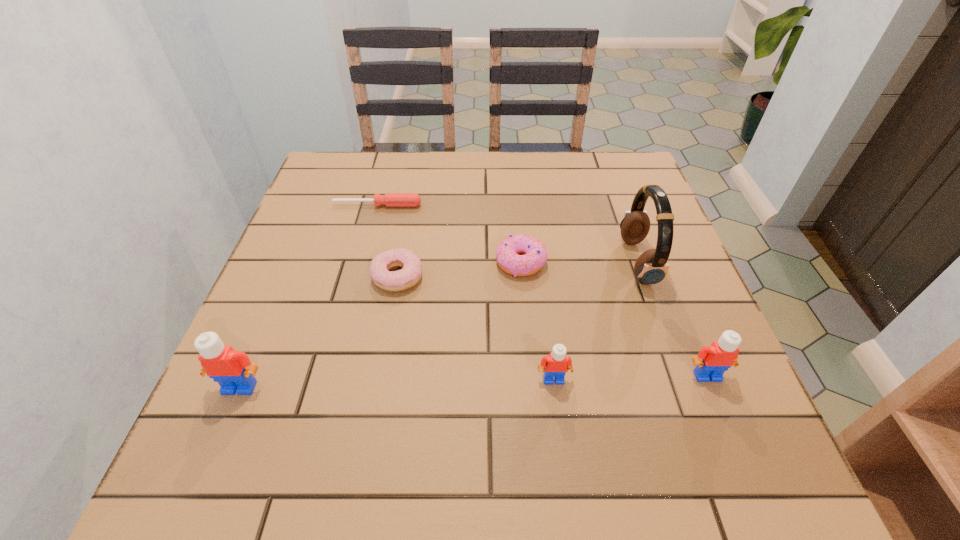
Find the location of a particular element. Image resolution: width=960 pixels, height=540 pixels. location for an additional Lego to make spacing equal is located at coordinates (397, 383).